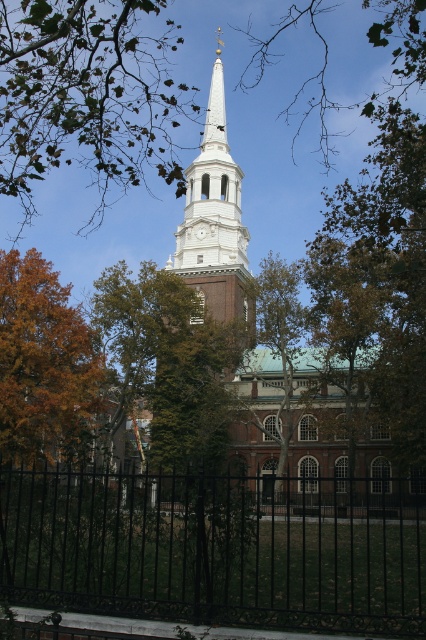
Is orange leafy tree at left bigger than white wood clock tower at center?

Incorrect, orange leafy tree at left is not larger than white wood clock tower at center.

Between point (58, 435) and point (201, 177), which one is positioned behind?

The point (201, 177) is behind.

Who is more distant from viewer, (91, 340) or (236, 176)?

Result: The point (236, 176) is more distant.

The height and width of the screenshot is (640, 426). What are the coordinates of `orange leafy tree at left` in the screenshot? It's located at (45, 365).

Does white wood clock tower at center have a lesser width compared to green leafy tree at center?

No, white wood clock tower at center is not thinner than green leafy tree at center.

Is white wood clock tower at center to the left of green leafy tree at center from the viewer's perspective?

Correct, you'll find white wood clock tower at center to the left of green leafy tree at center.

Between point (198, 292) and point (279, 268), which one is positioned behind?

Positioned behind is point (198, 292).

The height and width of the screenshot is (640, 426). Find the location of `white wood clock tower at center`. white wood clock tower at center is located at coordinates (215, 220).

Between point (305, 586) and point (66, 433), which one is positioned in front?

Positioned in front is point (305, 586).

Is black wrought iron fence at lower center to the right of orange leafy tree at left from the viewer's perspective?

Indeed, black wrought iron fence at lower center is positioned on the right side of orange leafy tree at left.

Who is more forward, (54,564) or (74,388)?

Point (54,564) is in front.

You are a GUI agent. You are given a task and a screenshot of the screen. Output one action in this format:
    pyautogui.click(x=<x>, y=<y>)
    Task: Click on the black wrought iron fence at lower center
    
    Given the screenshot: What is the action you would take?
    pyautogui.click(x=218, y=548)